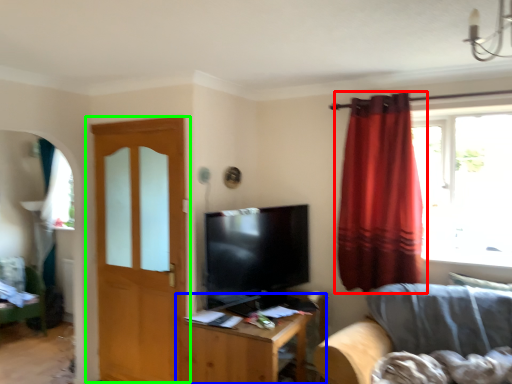
Question: Which is nearer to the curtain (highlighted by a red box)? table (highlighted by a blue box) or door (highlighted by a green box).

Choices:
 (A) table
 (B) door

Answer: (A)